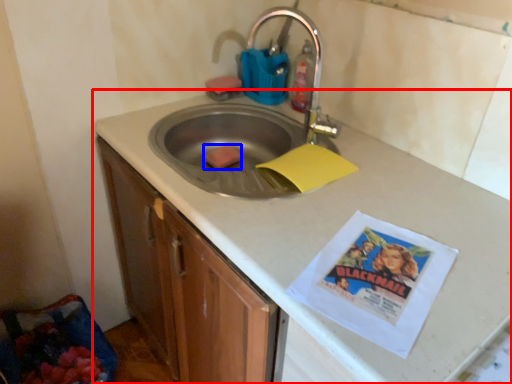
Question: Which object is further to the camera taking this photo, countertop (highlighted by a red box) or food (highlighted by a blue box)?

Choices:
 (A) countertop
 (B) food

Answer: (B)